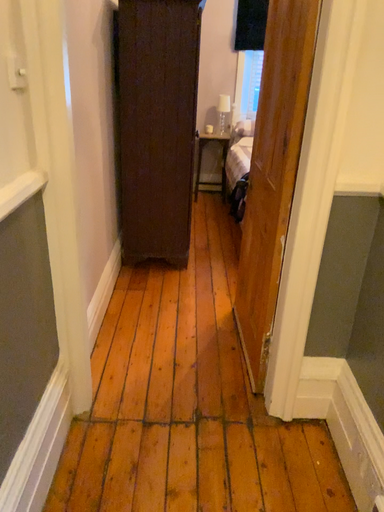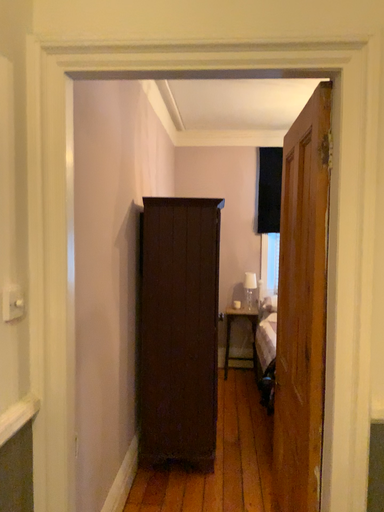
Question: Which way did the camera rotate in the video?

Choices:
 (A) rotated upward
 (B) rotated downward

Answer: (A)